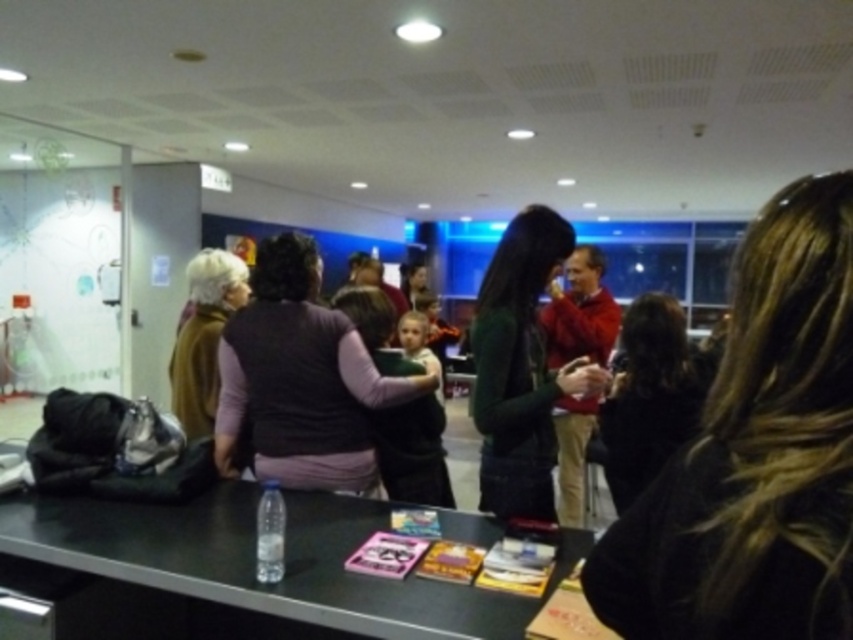
Does point (831, 198) lie behind point (264, 272)?

That is False.

Between point (733, 273) and point (345, 316), which one is positioned in front?

Point (733, 273)

Does point (815, 545) come in front of point (338, 458)?

Yes, it is in front of point (338, 458).

Identify the location of dark brown hair at center. The height and width of the screenshot is (640, 853). (756, 452).

Is dark brown hair at center below dark green sweater at center?

No, dark brown hair at center is not below dark green sweater at center.

Does dark brown hair at center have a greater height compared to dark green sweater at center?

In fact, dark brown hair at center may be shorter than dark green sweater at center.

Where is `dark brown hair at center`? The image size is (853, 640). dark brown hair at center is located at coordinates (756, 452).

Find the location of a particular element. Image resolution: width=853 pixels, height=640 pixels. dark brown hair at center is located at coordinates (756, 452).

The width and height of the screenshot is (853, 640). In order to click on black matte table at lower center in this screenshot , I will do `click(254, 560)`.

Between black matte table at lower center and brown wool sweater at left, which one appears on the right side from the viewer's perspective?

Positioned to the right is black matte table at lower center.

Between point (338, 545) and point (241, 268), which one is positioned in front?

Point (338, 545) is in front.

This screenshot has height=640, width=853. Identify the location of black matte table at lower center. (254, 560).